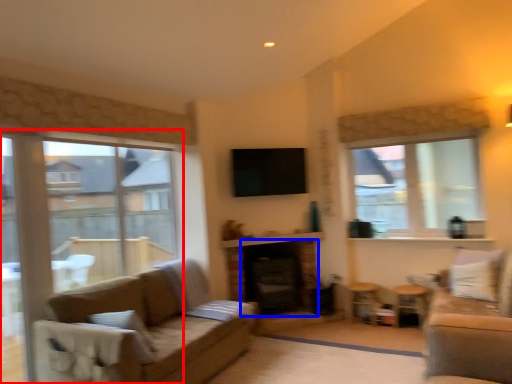
Question: Which object appears closest to the camera in this image, window (highlighted by a red box) or fireplace (highlighted by a blue box)?

Choices:
 (A) window
 (B) fireplace

Answer: (A)